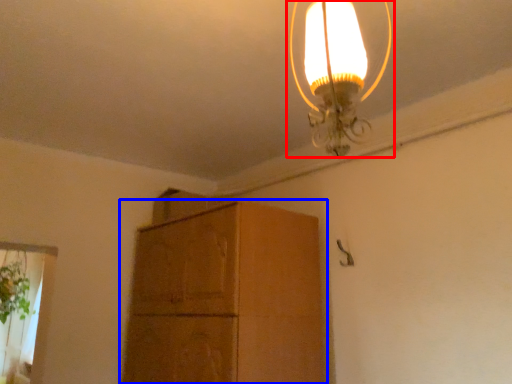
Question: Which of the following is the farthest to the observer, lamp (highlighted by a red box) or cabinetry (highlighted by a blue box)?

Choices:
 (A) lamp
 (B) cabinetry

Answer: (B)